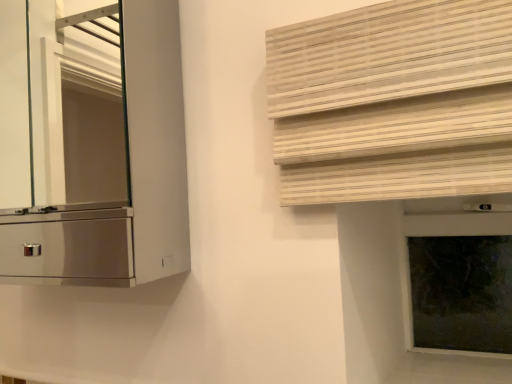
Question: Considering the positions of metallic silver cabinet at left and dark glass window frame at right in the image, is metallic silver cabinet at left wider or thinner than dark glass window frame at right?

Choices:
 (A) thin
 (B) wide

Answer: (B)

Question: Based on their sizes in the image, would you say metallic silver cabinet at left is bigger or smaller than dark glass window frame at right?

Choices:
 (A) small
 (B) big

Answer: (B)

Question: Estimate the real-world distances between objects in this image. Which object is closer to the dark glass window frame at right?

Choices:
 (A) natural wood blinds at upper right
 (B) metallic silver cabinet at left

Answer: (A)

Question: Which is nearer to the metallic silver cabinet at left?

Choices:
 (A) natural wood blinds at upper right
 (B) dark glass window frame at right

Answer: (B)